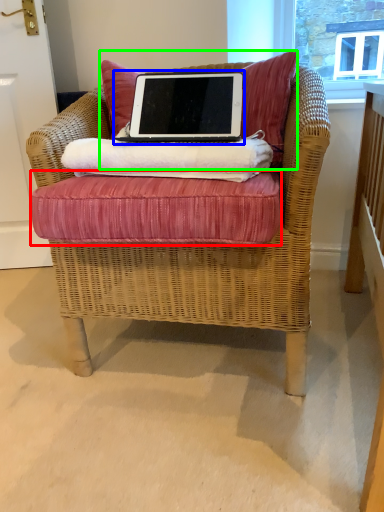
Question: Which object is the closest to the bed frame (highlighted by a red box)? Choose among these: laptop (highlighted by a blue box) or pillow (highlighted by a green box).

Choices:
 (A) laptop
 (B) pillow

Answer: (A)